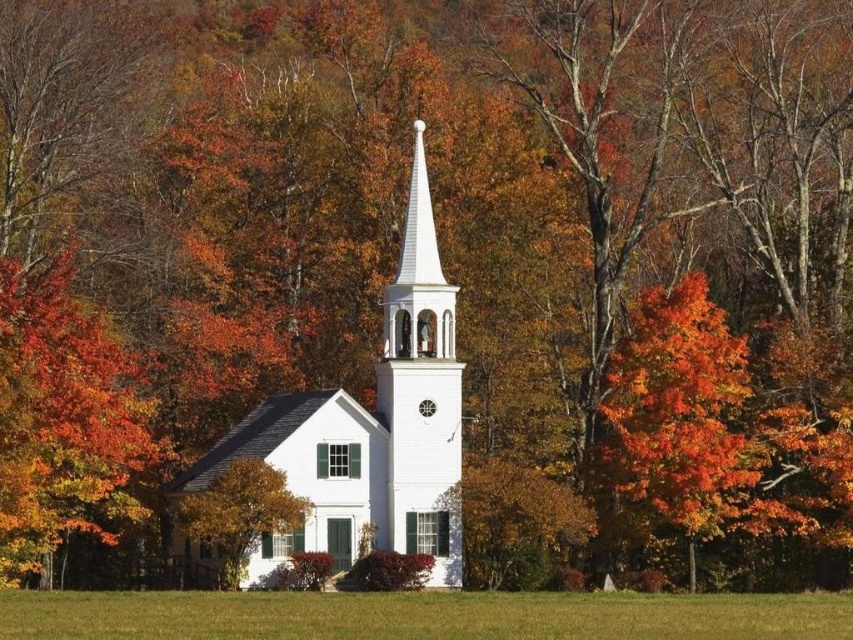
Question: Can you confirm if vivid orange leaves at right is positioned below smooth yellow tree at center?

Choices:
 (A) no
 (B) yes

Answer: (A)

Question: Which object appears farthest from the camera in this image?

Choices:
 (A) smooth yellow tree at center
 (B) vivid orange leaves at right

Answer: (B)

Question: Which of these objects is positioned farthest from the vivid orange leaves at right?

Choices:
 (A) smooth yellow tree at center
 (B) white smooth church steeple at center
 (C) green grass at center

Answer: (A)

Question: Among these points, which one is farthest from the camera?

Choices:
 (A) (x=412, y=484)
 (B) (x=155, y=634)

Answer: (A)

Question: Can you confirm if white smooth church steeple at center is wider than vivid orange leaves at right?

Choices:
 (A) no
 (B) yes

Answer: (B)

Question: Is green grass at center bigger than white smooth steeple at center?

Choices:
 (A) no
 (B) yes

Answer: (B)